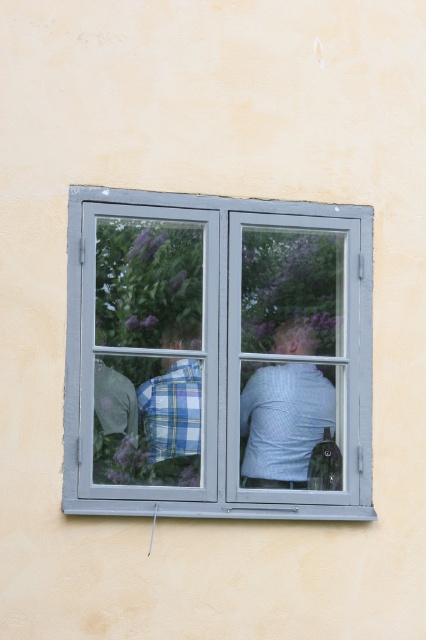
Can you confirm if blue plaid shirt at center is smaller than plaid shirt at center?

No, blue plaid shirt at center is not smaller than plaid shirt at center.

Describe the element at coordinates (152, 422) in the screenshot. I see `blue plaid shirt at center` at that location.

Locate an element on the screen. The image size is (426, 640). blue plaid shirt at center is located at coordinates (152, 422).

Who is shorter, gray metallic window at center or light blue checkered shirt at center?

light blue checkered shirt at center

Which is more to the right, gray metallic window at center or light blue checkered shirt at center?

From the viewer's perspective, light blue checkered shirt at center appears more on the right side.

Identify the location of gray metallic window at center. Image resolution: width=426 pixels, height=640 pixels. (216, 356).

The image size is (426, 640). What are the coordinates of `gray metallic window at center` in the screenshot? It's located at (216, 356).

Is light blue checkered shirt at center wider than plaid shirt at center?

Indeed, light blue checkered shirt at center has a greater width compared to plaid shirt at center.

Locate an element on the screen. light blue checkered shirt at center is located at coordinates (284, 422).

Is point (284, 326) less distant than point (189, 452)?

No, (284, 326) is behind (189, 452).

The image size is (426, 640). I want to click on light blue checkered shirt at center, so click(x=284, y=422).